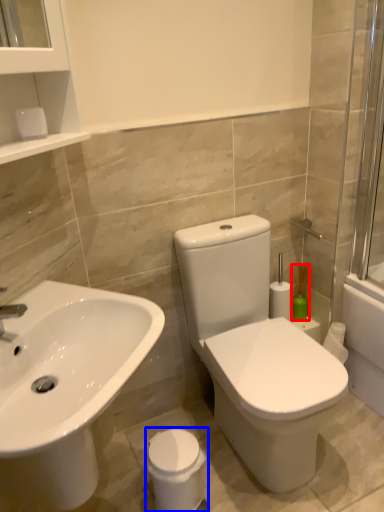
Question: Among these objects, which one is farthest to the camera, soap dispenser (highlighted by a red box) or porcelain (highlighted by a blue box)?

Choices:
 (A) soap dispenser
 (B) porcelain

Answer: (A)